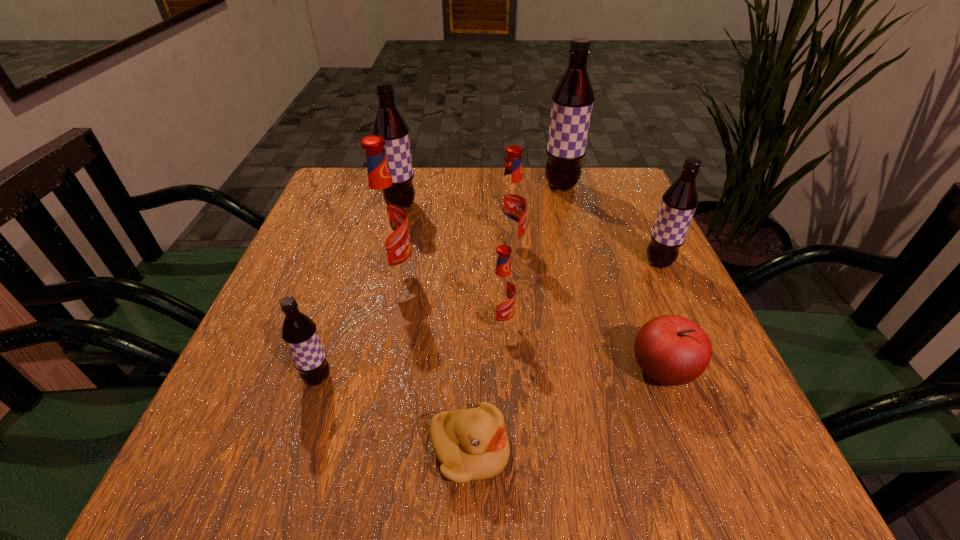
The width and height of the screenshot is (960, 540). In order to click on the second root beer from right to left in this screenshot , I will do `click(572, 100)`.

The width and height of the screenshot is (960, 540). What are the coordinates of `the farthest root beer` in the screenshot? It's located at (572, 100).

Identify the location of the second farthest red root beer. (385, 220).

Where is `the biggest red root beer`? The image size is (960, 540). the biggest red root beer is located at coordinates (385, 220).

I want to click on the sixth nearest root beer, so click(x=389, y=123).

At what (x,y) coordinates should I click in order to perform the action: click on the second farthest brown root beer. Please return your answer as a coordinate pair (x, y). Looking at the image, I should click on (389, 123).

Locate an element on the screen. the second biggest red root beer is located at coordinates (511, 203).

You are a GUI agent. You are given a task and a screenshot of the screen. Output one action in this format:
    pyautogui.click(x=<x>, y=<y>)
    Task: Click on the rightmost root beer
    This screenshot has width=960, height=540.
    Given the screenshot: What is the action you would take?
    pyautogui.click(x=679, y=202)

Find the location of a particular element. The width and height of the screenshot is (960, 540). the third farthest brown root beer is located at coordinates (679, 202).

You are a GUI agent. You are given a task and a screenshot of the screen. Output one action in this format:
    pyautogui.click(x=<x>, y=<y>)
    Task: Click on the smallest red root beer
    The width and height of the screenshot is (960, 540).
    Given the screenshot: What is the action you would take?
    pyautogui.click(x=502, y=289)